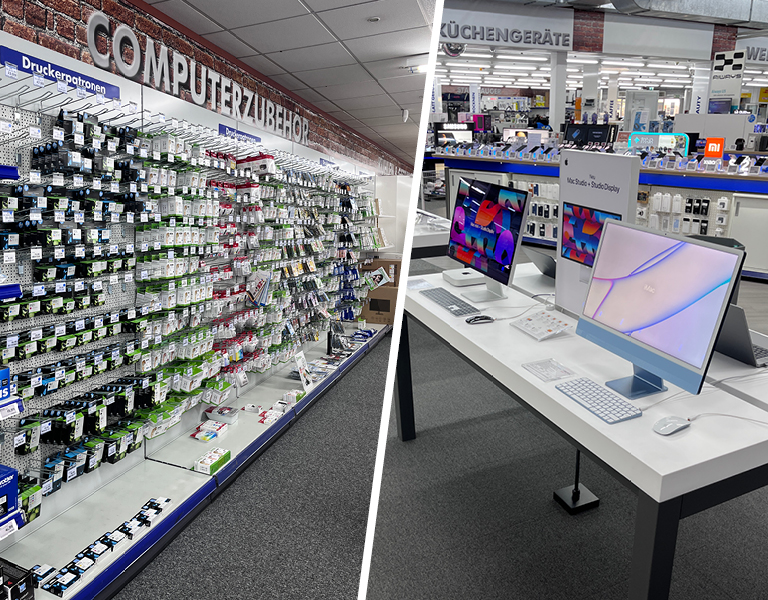
This screenshot has height=600, width=768. I want to click on mouse, so click(682, 426).